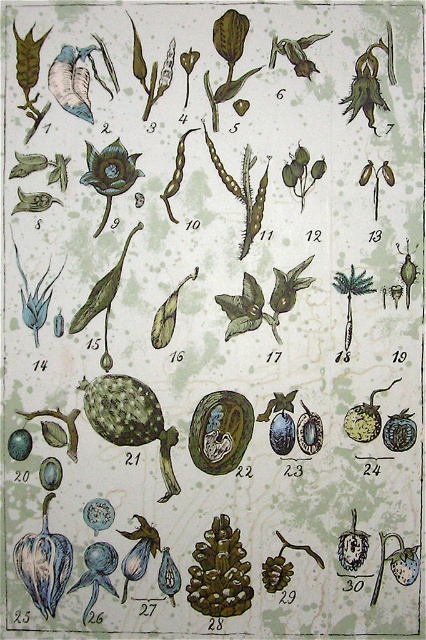
You are an artist creating a botanical painting and need to arrange the brown textured pine cone at center and the matte green flower at upper left in your artwork. Based on the illustration, which object should you place higher up in your painting to maintain the correct spatial relationship?

The brown textured pine cone at center should be placed higher up in the painting because it is much taller than the matte green flower at upper left.

In the botanical illustration, you see the brown textured pine cone at center and the matte green flower at upper left. Which object is positioned to the right of the other?

The brown textured pine cone at center is to the right of the matte green flower at upper left.